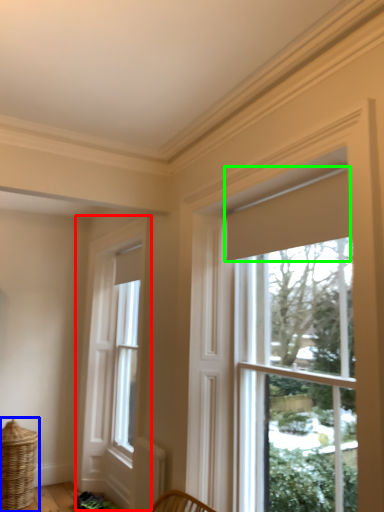
Question: Which object is positioned farthest from window (highlighted by a red box)? Select from basket (highlighted by a blue box) and curtain (highlighted by a green box).

Choices:
 (A) basket
 (B) curtain

Answer: (B)